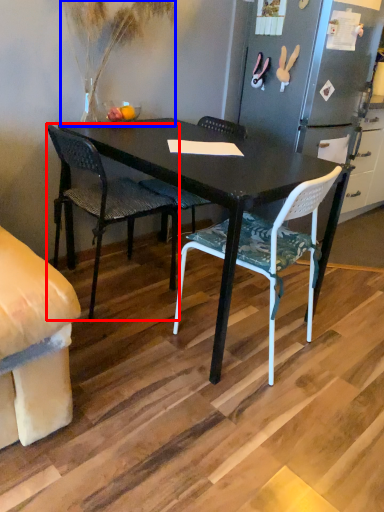
Question: Which object appears farthest to the camera in this image, chair (highlighted by a red box) or houseplant (highlighted by a blue box)?

Choices:
 (A) chair
 (B) houseplant

Answer: (A)